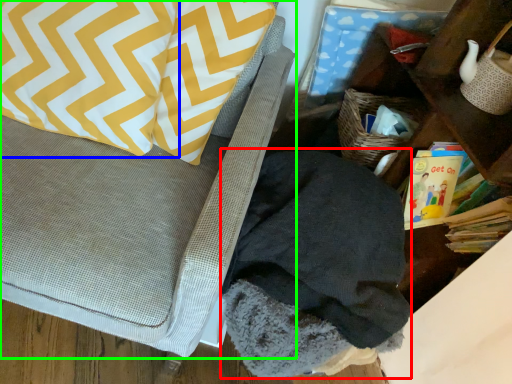
Question: Which object is positioned closest to clothing (highlighted by a red box)? Select from pillow (highlighted by a blue box) and furniture (highlighted by a green box).

Choices:
 (A) pillow
 (B) furniture

Answer: (B)